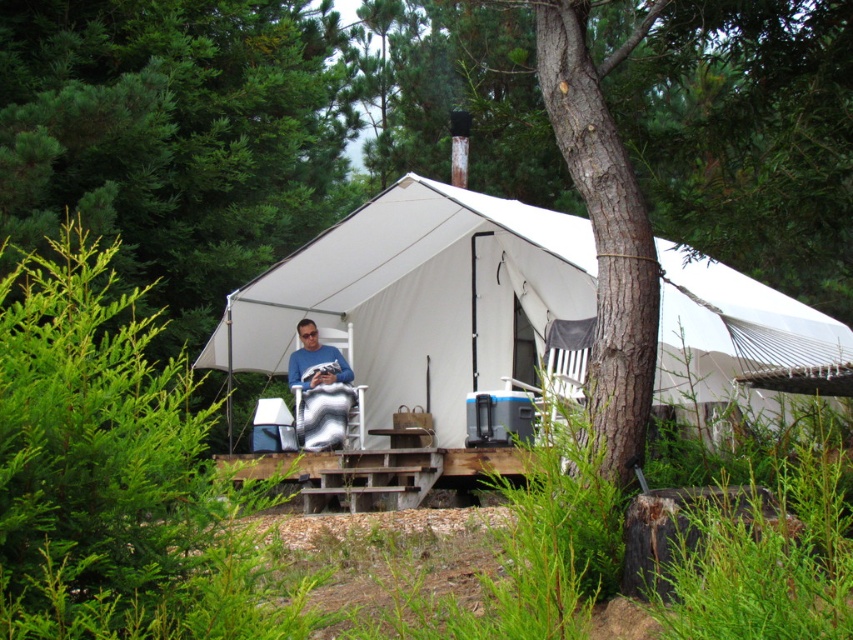
Question: Among these objects, which one is nearest to the camera?

Choices:
 (A) matte blue shirt at center
 (B) white canvas tent at center

Answer: (B)

Question: Which point is closer to the camera?

Choices:
 (A) white canvas tent at center
 (B) matte blue shirt at center

Answer: (A)

Question: Among these objects, which one is nearest to the camera?

Choices:
 (A) white canvas tent at center
 (B) matte blue shirt at center

Answer: (A)

Question: Does white canvas tent at center appear on the right side of matte blue shirt at center?

Choices:
 (A) yes
 (B) no

Answer: (A)

Question: Is white canvas tent at center closer to camera compared to matte blue shirt at center?

Choices:
 (A) no
 (B) yes

Answer: (B)

Question: Is white canvas tent at center wider than matte blue shirt at center?

Choices:
 (A) no
 (B) yes

Answer: (B)